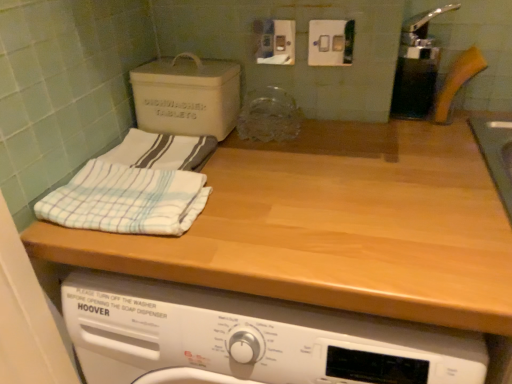
This screenshot has height=384, width=512. Identify the location of free location above matte gray cardboard box at upper left (from a real-world perspective). (183, 61).